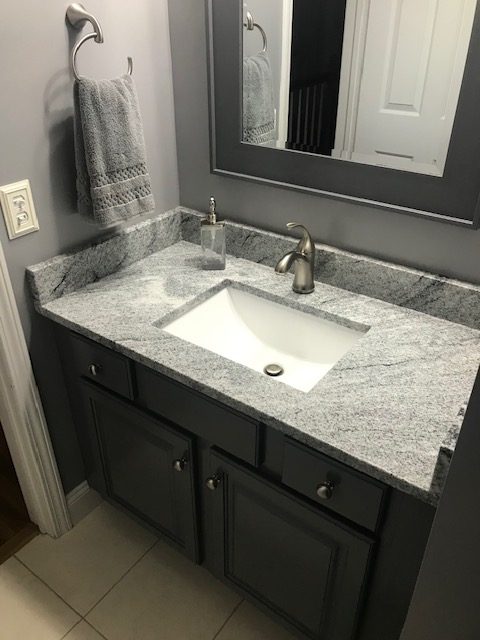
Locate an element on the screen. The image size is (480, 640). baseboard is located at coordinates (80, 500).